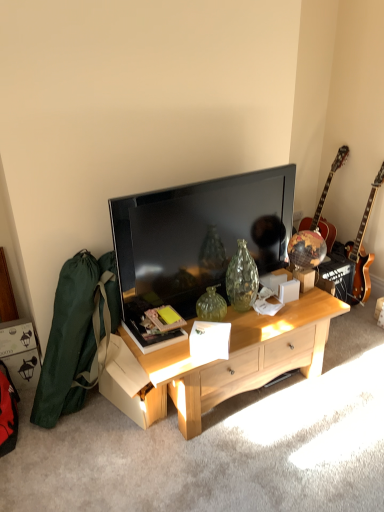
You are a GUI agent. You are given a task and a screenshot of the screen. Output one action in this format:
    pyautogui.click(x=<x>, y=<y>)
    Task: Click on the glossy wood guitar at right, the second guitar positioned from the left
    Image resolution: width=384 pixels, height=512 pixels.
    Given the screenshot: What is the action you would take?
    pyautogui.click(x=362, y=250)

At what (x,y) coordinates should I click in order to perform the action: click on wooden acoustic guitar at right, which is counted as the 1th guitar, starting from the left. Please return your answer as a coordinate pair (x, y). This screenshot has height=512, width=384. Looking at the image, I should click on (323, 204).

The height and width of the screenshot is (512, 384). I want to click on light wood cabinet at center, so click(220, 362).

Locate an element on the screen. The height and width of the screenshot is (512, 384). glossy wood guitar at right, the second guitar positioned from the left is located at coordinates (362, 250).

Could you tell me if wooden acoustic guitar at right, the 2th guitar in the right-to-left sequence, is facing light wood cabinet at center?

No, wooden acoustic guitar at right, the 2th guitar in the right-to-left sequence, is not aimed at light wood cabinet at center.

How far apart are wooden acoustic guitar at right, which is counted as the 1th guitar, starting from the left, and light wood cabinet at center?

4.19 feet.

Which is more distant, (326, 220) or (318, 320)?

The point (326, 220) is more distant.

Considering the relative sizes of wooden acoustic guitar at right, the 2th guitar in the right-to-left sequence, and light wood cabinet at center in the image provided, is wooden acoustic guitar at right, the 2th guitar in the right-to-left sequence, wider than light wood cabinet at center?

Incorrect, the width of wooden acoustic guitar at right, the 2th guitar in the right-to-left sequence, does not surpass that of light wood cabinet at center.

Does wooden acoustic guitar at right, the 2th guitar in the right-to-left sequence, have a smaller size compared to glossy wood guitar at right, the second guitar positioned from the left?

Actually, wooden acoustic guitar at right, the 2th guitar in the right-to-left sequence, might be larger than glossy wood guitar at right, the second guitar positioned from the left.

Considering the relative sizes of wooden acoustic guitar at right, which is counted as the 1th guitar, starting from the left, and glossy wood guitar at right, the first guitar positioned from the right, in the image provided, is wooden acoustic guitar at right, which is counted as the 1th guitar, starting from the left, wider than glossy wood guitar at right, the first guitar positioned from the right,?

Yes, wooden acoustic guitar at right, which is counted as the 1th guitar, starting from the left, is wider than glossy wood guitar at right, the first guitar positioned from the right.

Between wooden acoustic guitar at right, the 2th guitar in the right-to-left sequence, and glossy wood guitar at right, the first guitar positioned from the right, which one has less height?

Standing shorter between the two is wooden acoustic guitar at right, the 2th guitar in the right-to-left sequence.

From a real-world perspective, which is physically below, matte black tv at center or wooden acoustic guitar at right, the 2th guitar in the right-to-left sequence?

From a 3D spatial view, wooden acoustic guitar at right, the 2th guitar in the right-to-left sequence, is below.

Is matte black tv at center facing towards wooden acoustic guitar at right, the 2th guitar in the right-to-left sequence?

No, matte black tv at center does not turn towards wooden acoustic guitar at right, the 2th guitar in the right-to-left sequence.

Is matte black tv at center positioned behind wooden acoustic guitar at right, which is counted as the 1th guitar, starting from the left?

No, matte black tv at center is closer to the camera.

Considering the sizes of glossy wood guitar at right, the first guitar positioned from the right, and light wood cabinet at center in the image, is glossy wood guitar at right, the first guitar positioned from the right, bigger or smaller than light wood cabinet at center?

Considering their sizes, glossy wood guitar at right, the first guitar positioned from the right, takes up less space than light wood cabinet at center.

Is glossy wood guitar at right, the first guitar positioned from the right, located outside light wood cabinet at center?

Yes, glossy wood guitar at right, the first guitar positioned from the right, is outside of light wood cabinet at center.

Considering their positions, is glossy wood guitar at right, the first guitar positioned from the right, located in front of or behind light wood cabinet at center?

Clearly, glossy wood guitar at right, the first guitar positioned from the right, is behind light wood cabinet at center.

Is there a large distance between glossy wood guitar at right, the first guitar positioned from the right, and light wood cabinet at center?

glossy wood guitar at right, the first guitar positioned from the right, is far away from light wood cabinet at center.

Which of these two, matte black tv at center or glossy wood guitar at right, the second guitar positioned from the left, stands shorter?

With less height is matte black tv at center.

How different are the orientations of matte black tv at center and glossy wood guitar at right, the second guitar positioned from the left, in degrees?

The angular difference between matte black tv at center and glossy wood guitar at right, the second guitar positioned from the left, is 97.2 degrees.

From the image's perspective, which object appears higher, matte black tv at center or glossy wood guitar at right, the first guitar positioned from the right?

glossy wood guitar at right, the first guitar positioned from the right.

From a real-world perspective, which object rests below the other?

light wood cabinet at center.

Based on the photo, could glossy wood guitar at right, the first guitar positioned from the right, be considered to be inside light wood cabinet at center?

No.

Which of these two, light wood cabinet at center or glossy wood guitar at right, the second guitar positioned from the left, stands shorter?

With less height is light wood cabinet at center.

Is light wood cabinet at center to the left of glossy wood guitar at right, the first guitar positioned from the right, from the viewer's perspective?

Indeed, light wood cabinet at center is positioned on the left side of glossy wood guitar at right, the first guitar positioned from the right.

Who is shorter, light wood cabinet at center or wooden acoustic guitar at right, the 2th guitar in the right-to-left sequence?

With less height is light wood cabinet at center.

From the image's perspective, is light wood cabinet at center located above wooden acoustic guitar at right, which is counted as the 1th guitar, starting from the left?

No, from the image's perspective, light wood cabinet at center is not over wooden acoustic guitar at right, which is counted as the 1th guitar, starting from the left.

Who is more distant, light wood cabinet at center or wooden acoustic guitar at right, which is counted as the 1th guitar, starting from the left?

wooden acoustic guitar at right, which is counted as the 1th guitar, starting from the left, is further from the camera.

From a real-world perspective, is light wood cabinet at center physically located above or below wooden acoustic guitar at right, the 2th guitar in the right-to-left sequence?

Clearly, from a real-world perspective, light wood cabinet at center is below wooden acoustic guitar at right, the 2th guitar in the right-to-left sequence.

The width and height of the screenshot is (384, 512). I want to click on the 2nd guitar above the light wood cabinet at center (from the image's perspective), so click(323, 204).

At what (x,y) coordinates should I click in order to perform the action: click on guitar that is on the left side of glossy wood guitar at right, the first guitar positioned from the right. Please return your answer as a coordinate pair (x, y). Looking at the image, I should click on (x=323, y=204).

When comparing their distances from matte black tv at center, does wooden acoustic guitar at right, the 2th guitar in the right-to-left sequence, or light wood cabinet at center seem closer?

light wood cabinet at center.

Based on their spatial positions, is wooden acoustic guitar at right, the 2th guitar in the right-to-left sequence, or matte black tv at center further from glossy wood guitar at right, the second guitar positioned from the left?

The object further to glossy wood guitar at right, the second guitar positioned from the left, is matte black tv at center.

Based on their spatial positions, is light wood cabinet at center or wooden acoustic guitar at right, which is counted as the 1th guitar, starting from the left, closer to matte black tv at center?

light wood cabinet at center is closer to matte black tv at center.

Considering their positions, is wooden acoustic guitar at right, which is counted as the 1th guitar, starting from the left, positioned further to light wood cabinet at center than glossy wood guitar at right, the second guitar positioned from the left?

wooden acoustic guitar at right, which is counted as the 1th guitar, starting from the left.

Based on their spatial positions, is wooden acoustic guitar at right, which is counted as the 1th guitar, starting from the left, or matte black tv at center closer to light wood cabinet at center?

matte black tv at center lies closer to light wood cabinet at center than the other object.

Which object lies nearer to the anchor point matte black tv at center, light wood cabinet at center or glossy wood guitar at right, the first guitar positioned from the right?

Among the two, light wood cabinet at center is located nearer to matte black tv at center.

Considering their positions, is matte black tv at center positioned further to glossy wood guitar at right, the first guitar positioned from the right, than light wood cabinet at center?

matte black tv at center.

Estimate the real-world distances between objects in this image. Which object is further from glossy wood guitar at right, the second guitar positioned from the left, wooden acoustic guitar at right, the 2th guitar in the right-to-left sequence, or light wood cabinet at center?

light wood cabinet at center is positioned further to the anchor glossy wood guitar at right, the second guitar positioned from the left.

You are a GUI agent. You are given a task and a screenshot of the screen. Output one action in this format:
    pyautogui.click(x=<x>, y=<y>)
    Task: Click on the television between light wood cabinet at center and wooden acoustic guitar at right, the 2th guitar in the right-to-left sequence, along the z-axis
    The height and width of the screenshot is (512, 384).
    Given the screenshot: What is the action you would take?
    pyautogui.click(x=198, y=236)

Find the location of a particular element. The width and height of the screenshot is (384, 512). guitar between matte black tv at center and glossy wood guitar at right, the first guitar positioned from the right, in the horizontal direction is located at coordinates [x=323, y=204].

Identify the location of guitar between light wood cabinet at center and wooden acoustic guitar at right, the 2th guitar in the right-to-left sequence, in the front-back direction. This screenshot has height=512, width=384. (362, 250).

Where is `desk between matte black tv at center and glossy wood guitar at right, the first guitar positioned from the right, from left to right`? This screenshot has height=512, width=384. desk between matte black tv at center and glossy wood guitar at right, the first guitar positioned from the right, from left to right is located at coordinates point(220,362).